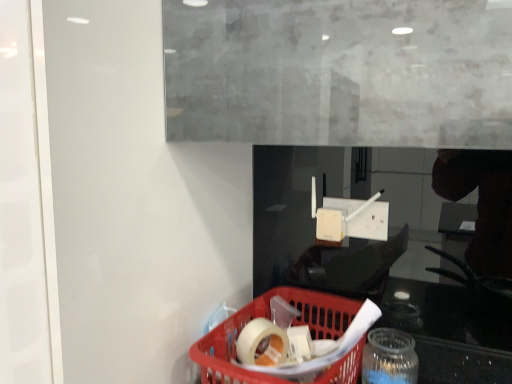
What do you see at coordinates (389, 358) in the screenshot? I see `transparent glass jar at lower right` at bounding box center [389, 358].

Where is `red plastic basket at lower center`? The image size is (512, 384). red plastic basket at lower center is located at coordinates (452, 332).

Locate an element on the screen. This screenshot has height=384, width=512. transparent glass jar at lower right is located at coordinates (389, 358).

From a real-world perspective, who is located higher, transparent glass jar at lower right or translucent plastic basket at lower center?

translucent plastic basket at lower center.

Based on the photo, measure the distance from transparent glass jar at lower right to translucent plastic basket at lower center.

transparent glass jar at lower right and translucent plastic basket at lower center are 15.85 centimeters apart from each other.

Considering the positions of objects transparent glass jar at lower right and translucent plastic basket at lower center in the image provided, who is more to the left, transparent glass jar at lower right or translucent plastic basket at lower center?

From the viewer's perspective, translucent plastic basket at lower center appears more on the left side.

From the image's perspective, is transparent glass jar at lower right positioned above or below translucent plastic basket at lower center?

Based on their image positions, transparent glass jar at lower right is located beneath translucent plastic basket at lower center.

Does translucent plastic basket at lower center come behind transparent glass jar at lower right?

No, translucent plastic basket at lower center is closer to the camera.

Considering the positions of point (334, 368) and point (365, 369), is point (334, 368) closer or farther from the camera than point (365, 369)?

Point (334, 368) is closer to the camera than point (365, 369).

How many degrees apart are the facing directions of translucent plastic basket at lower center and transparent glass jar at lower right?

0.00114 degrees separate the facing orientations of translucent plastic basket at lower center and transparent glass jar at lower right.

Is translucent plastic basket at lower center positioned far away from transparent glass jar at lower right?

No, translucent plastic basket at lower center is not far from transparent glass jar at lower right.

Looking at this image, from the image's perspective, would you say red plastic basket at lower center is shown under transparent glass jar at lower right?

No, from the image's perspective, red plastic basket at lower center is not below transparent glass jar at lower right.

Considering the sizes of objects red plastic basket at lower center and transparent glass jar at lower right in the image provided, who is taller, red plastic basket at lower center or transparent glass jar at lower right?

red plastic basket at lower center is taller.

Based on the photo, is red plastic basket at lower center thinner than transparent glass jar at lower right?

No, red plastic basket at lower center is not thinner than transparent glass jar at lower right.

Is translucent plastic basket at lower center at the right side of red plastic basket at lower center?

Incorrect, translucent plastic basket at lower center is not on the right side of red plastic basket at lower center.

Considering the sizes of objects translucent plastic basket at lower center and red plastic basket at lower center in the image provided, who is bigger, translucent plastic basket at lower center or red plastic basket at lower center?

Bigger between the two is red plastic basket at lower center.

Is translucent plastic basket at lower center oriented away from red plastic basket at lower center?

That's right, translucent plastic basket at lower center is facing away from red plastic basket at lower center.

Can you confirm if translucent plastic basket at lower center is shorter than red plastic basket at lower center?

Yes, translucent plastic basket at lower center is shorter than red plastic basket at lower center.

What's the angular difference between red plastic basket at lower center and translucent plastic basket at lower center's facing directions?

98.6 degrees separate the facing orientations of red plastic basket at lower center and translucent plastic basket at lower center.

Is red plastic basket at lower center closer to camera compared to translucent plastic basket at lower center?

Yes, it is.

Looking at this image, is red plastic basket at lower center turned away from translucent plastic basket at lower center?

red plastic basket at lower center does not have its back to translucent plastic basket at lower center.

Between point (271, 290) and point (218, 332), which one is positioned in front?

Positioned in front is point (218, 332).

Can you tell me how much transparent glass jar at lower right and red plastic basket at lower center differ in facing direction?

transparent glass jar at lower right and red plastic basket at lower center are facing 98.6 degrees away from each other.

In the scene shown: Considering the relative sizes of transparent glass jar at lower right and red plastic basket at lower center in the image provided, is transparent glass jar at lower right shorter than red plastic basket at lower center?

Correct, transparent glass jar at lower right is not as tall as red plastic basket at lower center.

Is transparent glass jar at lower right surrounding red plastic basket at lower center?

No, red plastic basket at lower center is not inside transparent glass jar at lower right.

Is transparent glass jar at lower right wider or thinner than red plastic basket at lower center?

In the image, transparent glass jar at lower right appears to be more narrow than red plastic basket at lower center.

Find the location of a particular element. The height and width of the screenshot is (384, 512). basket that appears above the transparent glass jar at lower right (from the image's perspective) is located at coordinates (269, 318).

The width and height of the screenshot is (512, 384). In order to click on basket in front of the transparent glass jar at lower right in this screenshot , I will do pos(269,318).

When comparing their distances from red plastic basket at lower center, does transparent glass jar at lower right or translucent plastic basket at lower center seem closer?

translucent plastic basket at lower center is positioned closer to the anchor red plastic basket at lower center.

From the image, which object appears to be farther from translucent plastic basket at lower center, transparent glass jar at lower right or red plastic basket at lower center?

transparent glass jar at lower right lies further to translucent plastic basket at lower center than the other object.

When comparing their distances from red plastic basket at lower center, does translucent plastic basket at lower center or transparent glass jar at lower right seem further?

Among the two, transparent glass jar at lower right is located further to red plastic basket at lower center.

Which object lies nearer to the anchor point transparent glass jar at lower right, translucent plastic basket at lower center or red plastic basket at lower center?

red plastic basket at lower center.

Estimate the real-world distances between objects in this image. Which object is further from transparent glass jar at lower right, red plastic basket at lower center or translucent plastic basket at lower center?

translucent plastic basket at lower center is positioned further to the anchor transparent glass jar at lower right.

From the image, which object appears to be nearer to translucent plastic basket at lower center, red plastic basket at lower center or transparent glass jar at lower right?

red plastic basket at lower center lies closer to translucent plastic basket at lower center than the other object.

Locate an element on the screen. basket between red plastic basket at lower center and transparent glass jar at lower right from front to back is located at coordinates (269, 318).